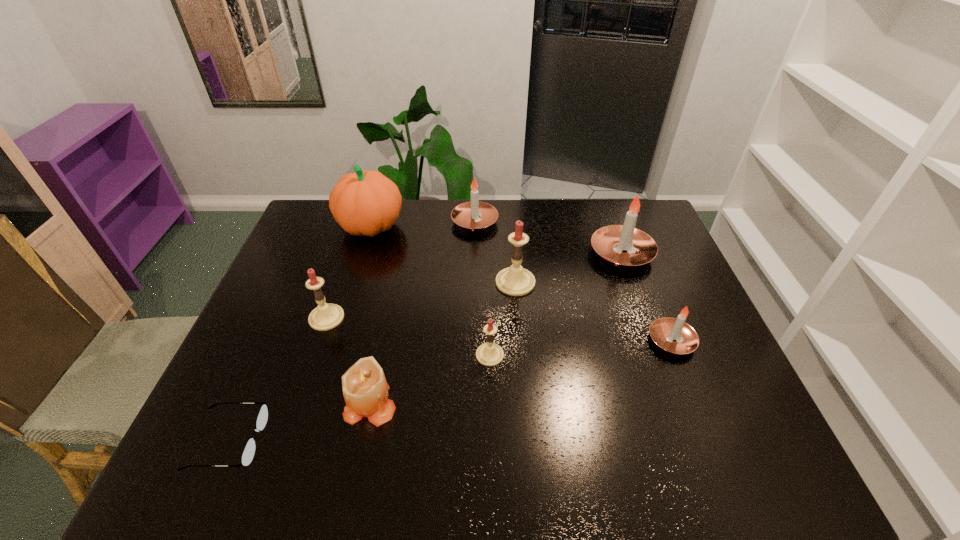
Where is `orange pumpkin`? The height and width of the screenshot is (540, 960). orange pumpkin is located at coordinates (364, 202).

At what (x,y) coordinates should I click in order to perform the action: click on the biggest white candle. Please return your answer as a coordinate pair (x, y). Image resolution: width=960 pixels, height=540 pixels. Looking at the image, I should click on (624, 245).

At what (x,y) coordinates should I click in order to perform the action: click on the farthest red candle. Please return your answer as a coordinate pair (x, y). Looking at the image, I should click on (515, 280).

Locate an element on the screen. the leftmost white candle is located at coordinates (474, 216).

Where is `the second smallest red candle`? the second smallest red candle is located at coordinates (325, 316).

Find the location of a particular element. This screenshot has height=540, width=960. the leftmost candle is located at coordinates (325, 316).

Locate an element on the screen. The height and width of the screenshot is (540, 960). the nearest white candle is located at coordinates pyautogui.click(x=674, y=335).

This screenshot has width=960, height=540. In order to click on the nearest red candle in this screenshot , I will do click(489, 354).

This screenshot has width=960, height=540. Find the location of `the nearest candle`. the nearest candle is located at coordinates (365, 389).

You are a GUI agent. You are given a task and a screenshot of the screen. Output one action in this format:
    pyautogui.click(x=<x>, y=<y>)
    Task: Click on the beige candle
    The width and height of the screenshot is (960, 540).
    Given the screenshot: What is the action you would take?
    pyautogui.click(x=365, y=389)